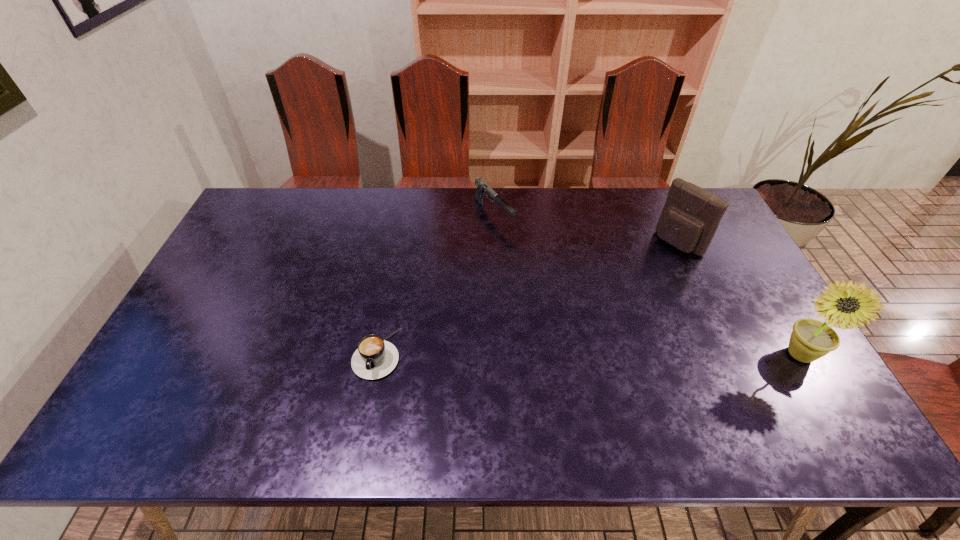
At what (x,y) coordinates should I click in order to perform the action: click on pouch present at the right edge. Please return your answer as a coordinate pair (x, y). Image resolution: width=960 pixels, height=540 pixels. Looking at the image, I should click on coord(691,215).

This screenshot has height=540, width=960. In order to click on object positioned at the far right corner in this screenshot , I will do `click(691, 215)`.

Identify the location of object present at the near right corner. The width and height of the screenshot is (960, 540). (811, 339).

The height and width of the screenshot is (540, 960). Identify the location of vacant space at the far edge of the desktop. (439, 195).

Image resolution: width=960 pixels, height=540 pixels. I want to click on blank space at the near edge of the desktop, so click(533, 373).

Image resolution: width=960 pixels, height=540 pixels. I want to click on free space at the left edge, so click(243, 316).

In the image, there is a desktop. Where is `vacant space at the right edge`? The width and height of the screenshot is (960, 540). vacant space at the right edge is located at coordinates (744, 368).

Find the location of a particular element. Image resolution: width=960 pixels, height=540 pixels. vacant space at the far left corner of the desktop is located at coordinates (260, 201).

Identify the location of free spot between the pouch and the third object from right to left. The height and width of the screenshot is (540, 960). (586, 228).

Where is `free space between the third object from right to left and the cappuccino`? free space between the third object from right to left and the cappuccino is located at coordinates (436, 284).